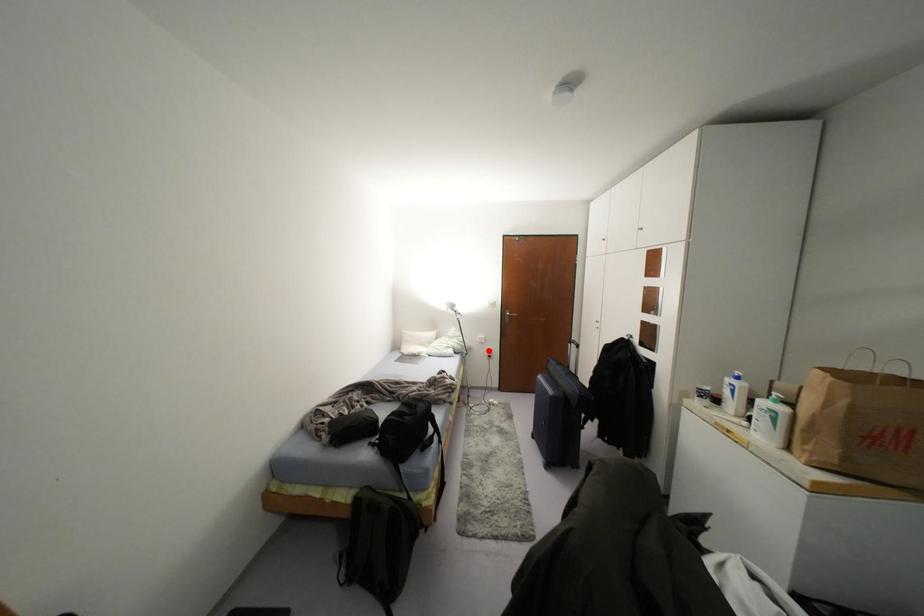
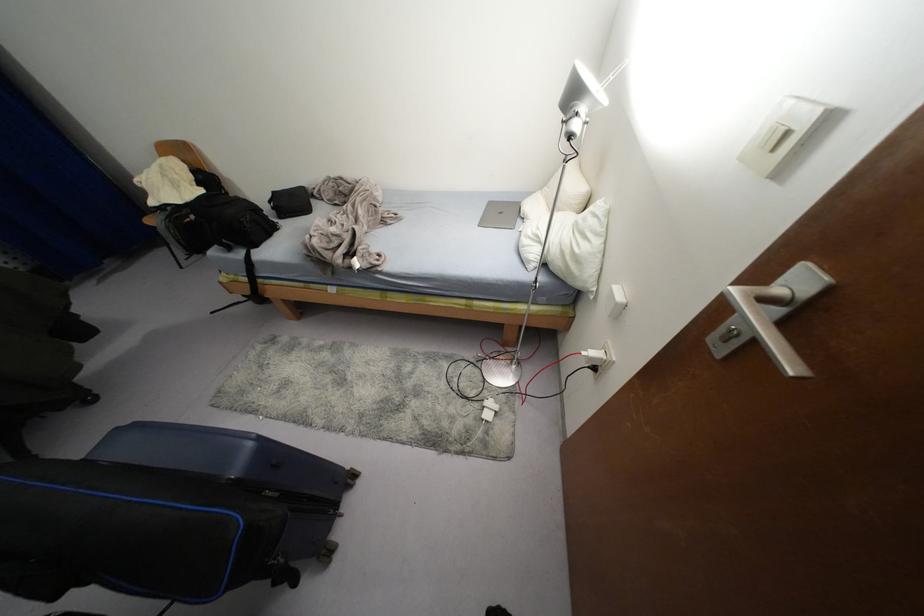
Locate, in the second image, the point that corresponds to the highlighted location in the first image.

(592, 353)